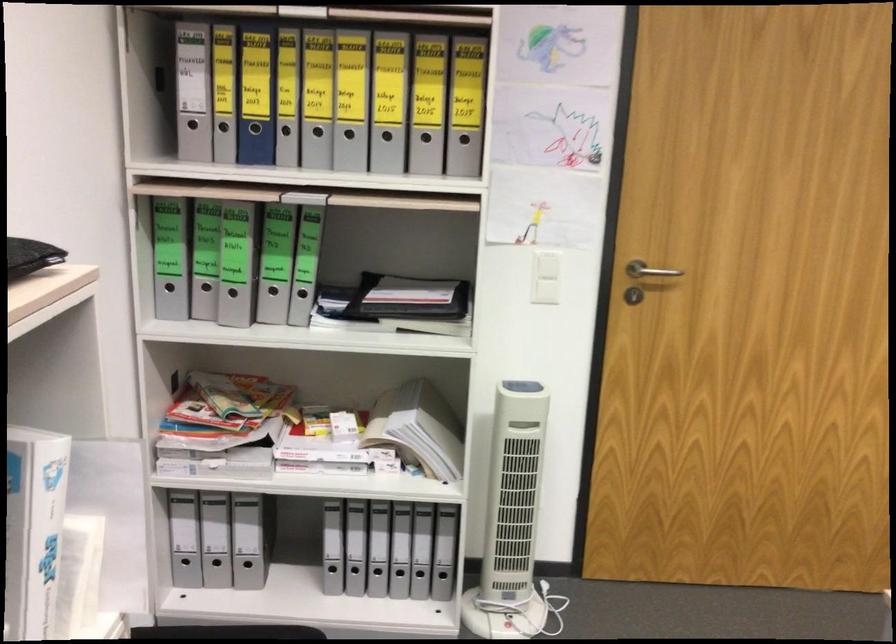
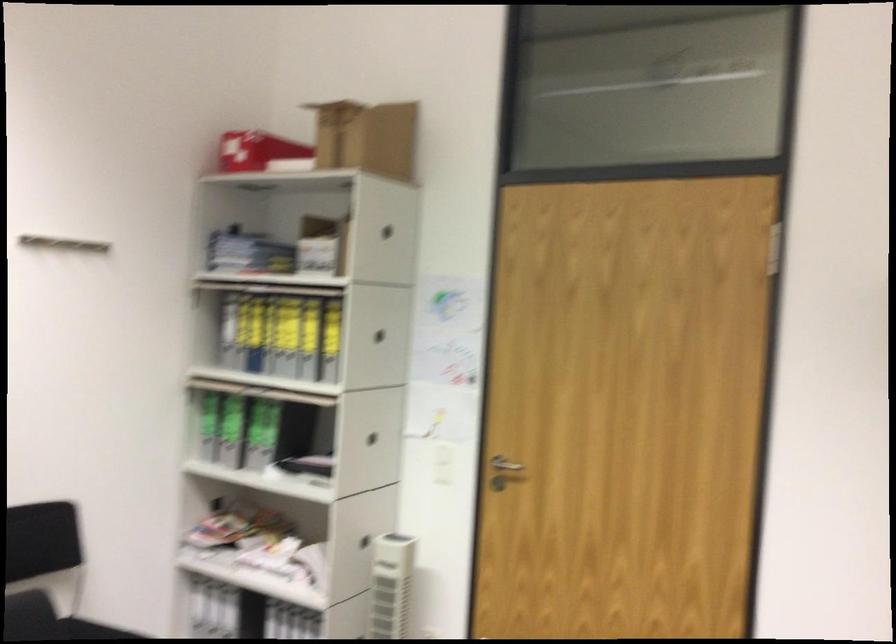
Find the pixel in the second image that matches the point at 554,281 in the first image.

(444, 462)